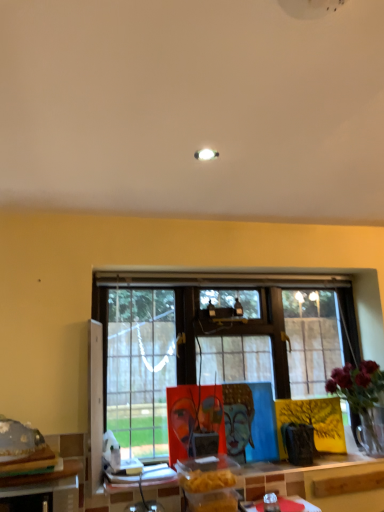
Locate an element on the screen. This screenshot has height=512, width=384. wooden table at lower center, acting as the first table starting from the back is located at coordinates point(321,482).

Find the location of a particular element. green leafy plant at right is located at coordinates (359, 391).

Which is correct: green leafy plant at right is inside wooden table at lower left, which is the 1th table from left to right, or outside of it?

green leafy plant at right cannot be found inside wooden table at lower left, which is the 1th table from left to right.

What's the angular difference between green leafy plant at right and wooden table at lower left, the 2th table from the right,'s facing directions?

The angle between the facing direction of green leafy plant at right and the facing direction of wooden table at lower left, the 2th table from the right, is 0.00753 degrees.

Considering the relative positions of green leafy plant at right and wooden table at lower left, the 2th table from the right, in the image provided, is green leafy plant at right to the left of wooden table at lower left, the 2th table from the right, from the viewer's perspective?

Incorrect, green leafy plant at right is not on the left side of wooden table at lower left, the 2th table from the right.

Considering the sizes of objects green leafy plant at right and wooden table at lower left, the 2th table from the right, in the image provided, who is thinner, green leafy plant at right or wooden table at lower left, the 2th table from the right,?

Thinner between the two is green leafy plant at right.

Can you tell me how much shiny metallic food at lower left and wooden table at lower center, arranged as the 2th table when viewed from the front, differ in facing direction?

shiny metallic food at lower left and wooden table at lower center, arranged as the 2th table when viewed from the front, are facing 3.59 degrees away from each other.

Which of these two, shiny metallic food at lower left or wooden table at lower center, arranged as the 2th table when viewed from the front, is bigger?

With larger size is wooden table at lower center, arranged as the 2th table when viewed from the front.

From the picture: Which object is more forward, shiny metallic food at lower left or wooden table at lower center, arranged as the 2th table when viewed from the front?

shiny metallic food at lower left.

From the image's perspective, does shiny metallic food at lower left appear lower than wooden table at lower center, acting as the first table starting from the back?

Actually, shiny metallic food at lower left appears above wooden table at lower center, acting as the first table starting from the back, in the image.

Consider the image. Which of these two, wooden table at lower center, acting as the first table starting from the back, or wooden table at lower left, the 1th table from the front, is bigger?

wooden table at lower left, the 1th table from the front, is bigger.

The width and height of the screenshot is (384, 512). I want to click on table behind the wooden table at lower left, the 2th table from the right, so click(321, 482).

Is wooden table at lower center, acting as the first table starting from the back, positioned with its back to wooden table at lower left, which is the 1th table from left to right?

No, wooden table at lower center, acting as the first table starting from the back, is not facing the opposite direction of wooden table at lower left, which is the 1th table from left to right.

Visually, is wooden table at lower left, the 2th table from the right, positioned to the left or to the right of green leafy plant at right?

wooden table at lower left, the 2th table from the right, is to the left of green leafy plant at right.

Is wooden table at lower left, the 2th table from the right, oriented away from green leafy plant at right?

No, wooden table at lower left, the 2th table from the right, is not facing away from green leafy plant at right.

Is wooden table at lower left, which is the 2th table in back-to-front order, placed right next to green leafy plant at right?

No, wooden table at lower left, which is the 2th table in back-to-front order, is not making contact with green leafy plant at right.

Which of these two, wooden table at lower left, the 1th table from the front, or green leafy plant at right, is smaller?

Smaller between the two is wooden table at lower left, the 1th table from the front.

Considering the points (368, 395) and (322, 466), which point is in front, point (368, 395) or point (322, 466)?

The point (322, 466) is closer.

From the image's perspective, which is below, green leafy plant at right or wooden table at lower center, the 2th table from the left?

wooden table at lower center, the 2th table from the left.

Looking at their sizes, would you say green leafy plant at right is wider or thinner than wooden table at lower center, acting as the first table starting from the back?

Clearly, green leafy plant at right has more width compared to wooden table at lower center, acting as the first table starting from the back.

How many degrees apart are the facing directions of green leafy plant at right and wooden table at lower center, arranged as the 2th table when viewed from the front?

The angular difference between green leafy plant at right and wooden table at lower center, arranged as the 2th table when viewed from the front, is 1.33 degrees.

Which object is thinner, wooden table at lower center, the 2th table from the left, or shiny metallic food at lower left?

Thinner between the two is wooden table at lower center, the 2th table from the left.

From the image's perspective, is wooden table at lower center, the 1th table positioned from the right, located above or below shiny metallic food at lower left?

A: wooden table at lower center, the 1th table positioned from the right, is situated lower than shiny metallic food at lower left in the image.

Is wooden table at lower center, the 2th table from the left, facing towards shiny metallic food at lower left?

No.

Is wooden table at lower left, the 2th table from the right, facing towards wooden table at lower center, the 1th table positioned from the right?

No, wooden table at lower left, the 2th table from the right, does not turn towards wooden table at lower center, the 1th table positioned from the right.

Is wooden table at lower left, which is the 1th table from left to right, shorter than wooden table at lower center, arranged as the 2th table when viewed from the front?

No.

How many degrees apart are the facing directions of wooden table at lower left, which is the 1th table from left to right, and wooden table at lower center, the 2th table from the left?

The angle between the facing direction of wooden table at lower left, which is the 1th table from left to right, and the facing direction of wooden table at lower center, the 2th table from the left, is 1.32 degrees.

Are wooden table at lower left, which is the 1th table from left to right, and wooden table at lower center, the 1th table positioned from the right, making contact?

No, wooden table at lower left, which is the 1th table from left to right, is not touching wooden table at lower center, the 1th table positioned from the right.

Where is `houseplant behind the wooden table at lower left, which is the 1th table from left to right`? This screenshot has width=384, height=512. houseplant behind the wooden table at lower left, which is the 1th table from left to right is located at coordinates (359, 391).

Where is `food that is above the wooden table at lower center, the 2th table from the left (from the image's perspective)`? food that is above the wooden table at lower center, the 2th table from the left (from the image's perspective) is located at coordinates (18, 440).

Estimate the real-world distances between objects in this image. Which object is closer to wooden table at lower center, arranged as the 2th table when viewed from the front, shiny metallic food at lower left or green leafy plant at right?

green leafy plant at right is positioned closer to the anchor wooden table at lower center, arranged as the 2th table when viewed from the front.

From the image, which object appears to be farther from shiny metallic food at lower left, green leafy plant at right or wooden table at lower center, the 2th table from the left?

green leafy plant at right.

Consider the image. Looking at the image, which one is located closer to wooden table at lower center, the 1th table positioned from the right, wooden table at lower left, the 1th table from the front, or shiny metallic food at lower left?

wooden table at lower left, the 1th table from the front.

Looking at this image, when comparing their distances from green leafy plant at right, does wooden table at lower center, acting as the first table starting from the back, or wooden table at lower left, which is the 1th table from left to right, seem further?

wooden table at lower left, which is the 1th table from left to right, is positioned further to the anchor green leafy plant at right.

Which object lies nearer to the anchor point wooden table at lower left, the 1th table from the front, green leafy plant at right or shiny metallic food at lower left?

shiny metallic food at lower left is closer to wooden table at lower left, the 1th table from the front.

Based on their spatial positions, is wooden table at lower center, the 1th table positioned from the right, or wooden table at lower left, the 2th table from the right, closer to shiny metallic food at lower left?

Based on the image, wooden table at lower left, the 2th table from the right, appears to be nearer to shiny metallic food at lower left.

Considering their positions, is green leafy plant at right positioned further to wooden table at lower left, which is the 1th table from left to right, than wooden table at lower center, acting as the first table starting from the back?

The object further to wooden table at lower left, which is the 1th table from left to right, is green leafy plant at right.

Which object lies nearer to the anchor point wooden table at lower center, the 1th table positioned from the right, green leafy plant at right or shiny metallic food at lower left?

Based on the image, green leafy plant at right appears to be nearer to wooden table at lower center, the 1th table positioned from the right.

The width and height of the screenshot is (384, 512). Find the location of `table located between shiny metallic food at lower left and wooden table at lower center, arranged as the 2th table when viewed from the front, in the left-right direction`. table located between shiny metallic food at lower left and wooden table at lower center, arranged as the 2th table when viewed from the front, in the left-right direction is located at coordinates (44, 490).

You are a GUI agent. You are given a task and a screenshot of the screen. Output one action in this format:
    pyautogui.click(x=<x>, y=<y>)
    Task: Click on the table between wooden table at lower left, the 1th table from the front, and green leafy plant at right, in the horizontal direction
    The width and height of the screenshot is (384, 512).
    Given the screenshot: What is the action you would take?
    pyautogui.click(x=321, y=482)